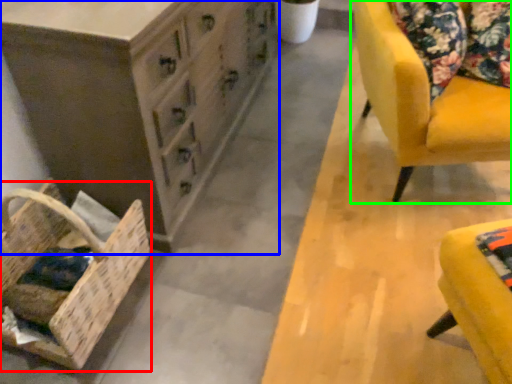
Question: Which object is the closest to the basket (highlighted by a red box)? Choose among these: chest of drawers (highlighted by a blue box) or chair (highlighted by a green box).

Choices:
 (A) chest of drawers
 (B) chair

Answer: (A)